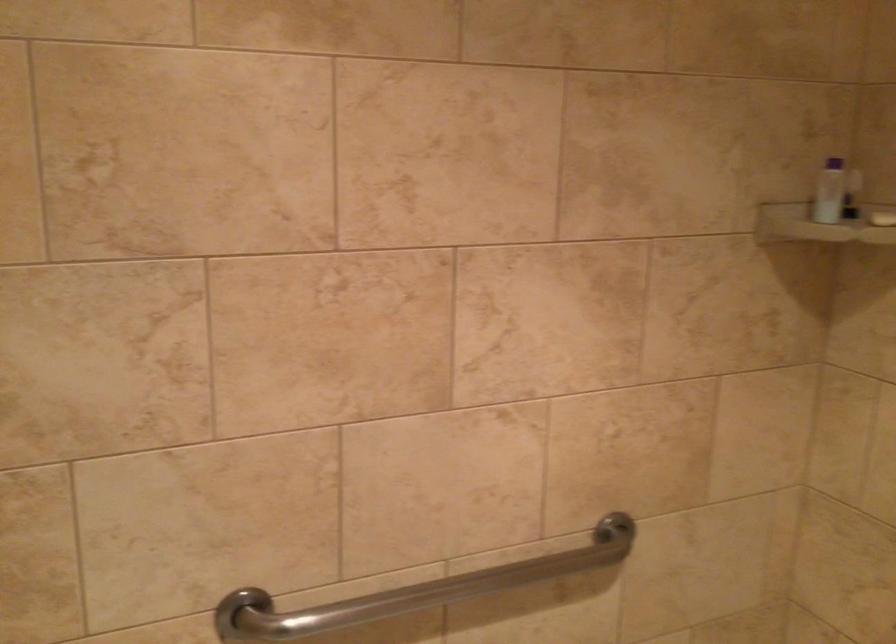
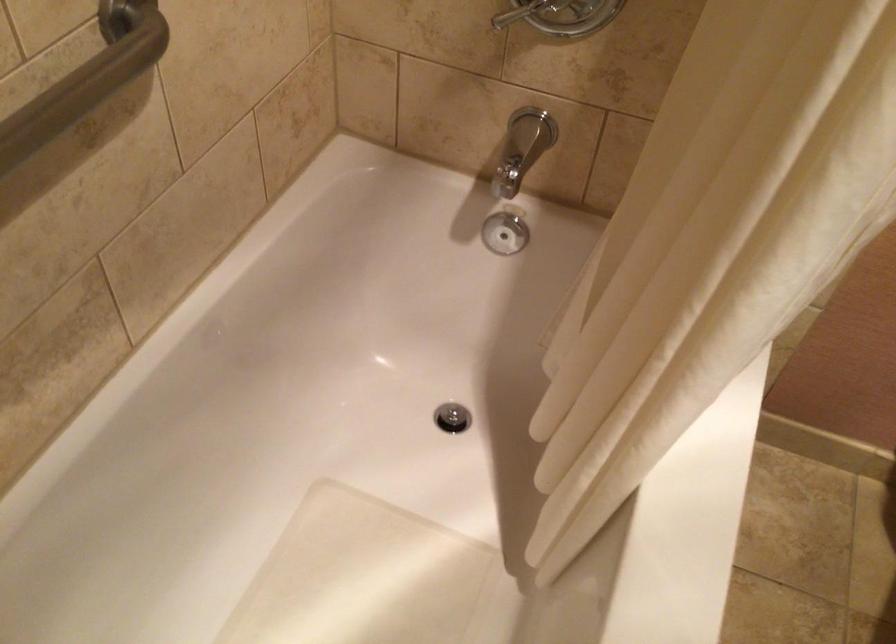
First-person continuous shooting, in which direction is the camera rotating?

The camera's rotation is toward right-down.